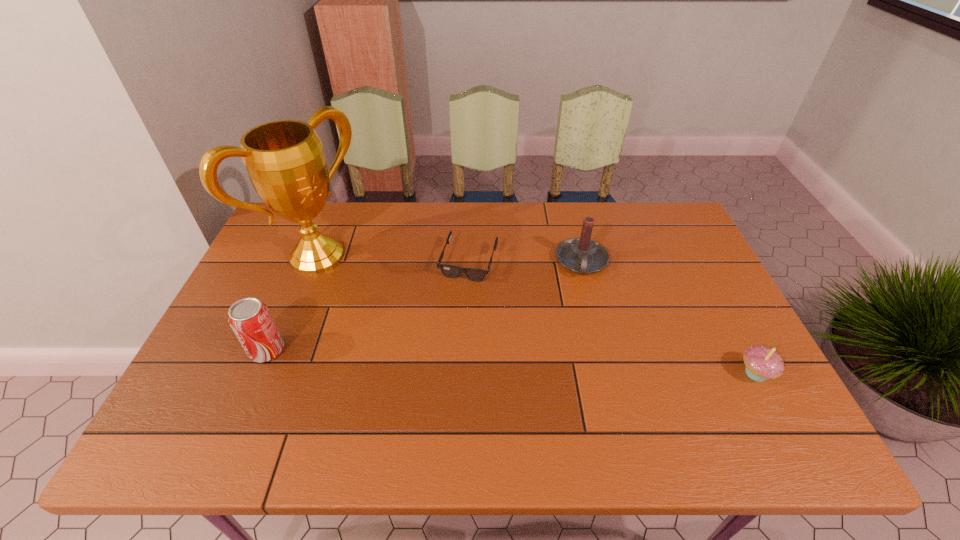
In order to click on vacant space located 0.380m on the front-facing side of the award in this screenshot , I will do `click(438, 349)`.

Where is `blank space located 0.160m on the front-facing side of the award`? This screenshot has height=540, width=960. blank space located 0.160m on the front-facing side of the award is located at coordinates (380, 307).

Where is `vacant space positioned 0.330m on the side of the fourth object from left to right with the handle loop`? This screenshot has height=540, width=960. vacant space positioned 0.330m on the side of the fourth object from left to right with the handle loop is located at coordinates (580, 379).

This screenshot has width=960, height=540. I want to click on blank space located on the side of the fourth object from left to right with the handle loop, so click(580, 397).

Image resolution: width=960 pixels, height=540 pixels. I want to click on vacant space located 0.180m on the side of the fourth object from left to right with the handle loop, so click(581, 330).

At what (x,y) coordinates should I click in order to perform the action: click on vacant space located on the temples of the third object from right to left. Please return your answer as a coordinate pair (x, y). This screenshot has height=540, width=960. Looking at the image, I should click on (443, 339).

This screenshot has height=540, width=960. Find the location of `vacant space located on the temples of the third object from right to left`. vacant space located on the temples of the third object from right to left is located at coordinates (451, 313).

The height and width of the screenshot is (540, 960). Identify the location of free location located 0.160m on the temples of the third object from right to left. (447, 325).

Where is `award that is at the far edge`? This screenshot has width=960, height=540. award that is at the far edge is located at coordinates (284, 159).

You are a GUI agent. You are given a task and a screenshot of the screen. Output one action in this format:
    pyautogui.click(x=<x>, y=<y>)
    Task: Click on the candle that is at the far edge
    This screenshot has width=960, height=540.
    Given the screenshot: What is the action you would take?
    pyautogui.click(x=582, y=255)